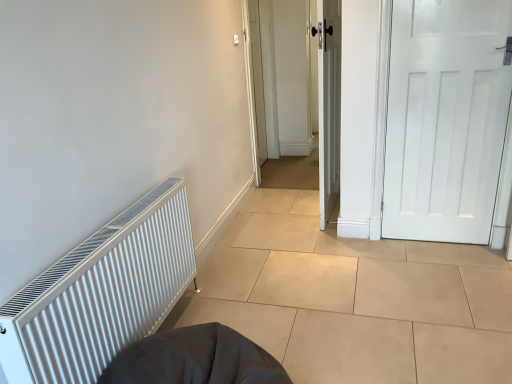
At what (x,y) coordinates should I click in order to perform the action: click on free space in front of white wooden door at center, marked as the second door in a right-to-left arrangement. Please return your answer as a coordinate pair (x, y). Looking at the image, I should click on (334, 244).